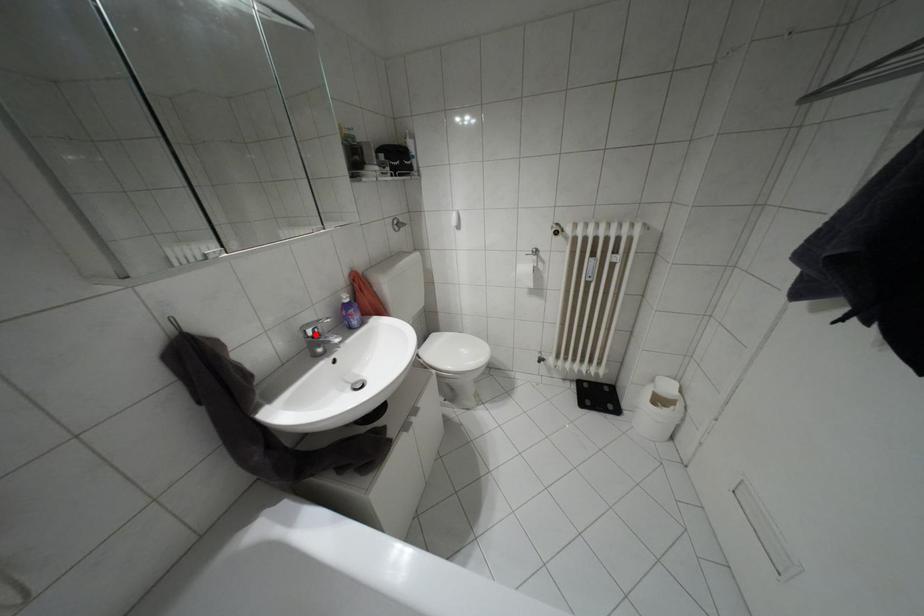
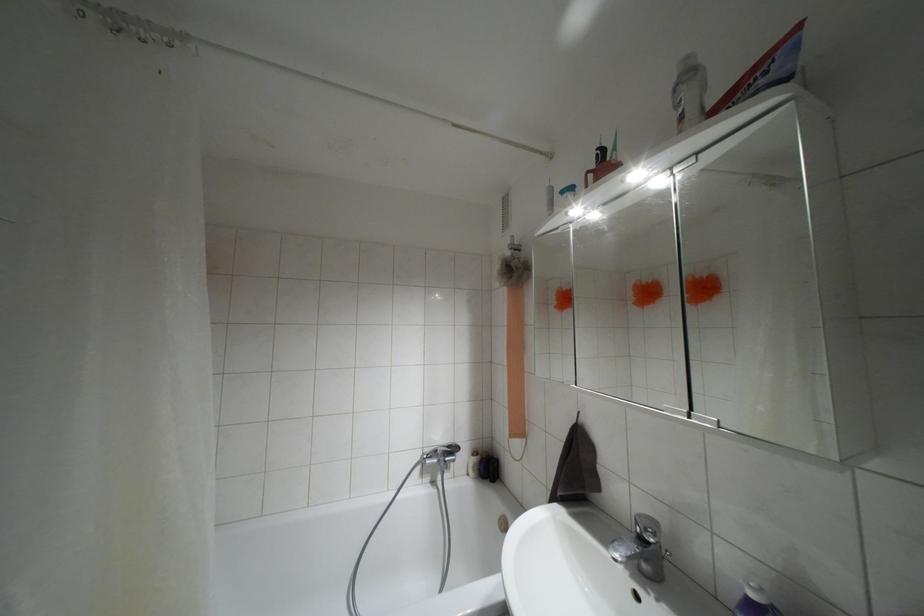
Locate, in the second image, the point that corresponds to the highlighted location in the first image.

(641, 538)